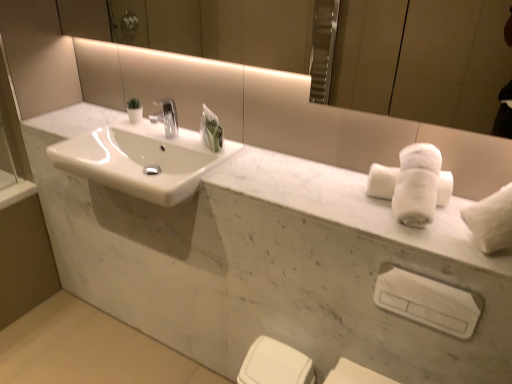
Image resolution: width=512 pixels, height=384 pixels. What do you see at coordinates (268, 263) in the screenshot?
I see `white marble sink at center, the 2th porcelain when ordered from bottom to top` at bounding box center [268, 263].

Measure the distance between white plastic towel bar at lower right and camera.

A distance of 3.40 feet exists between white plastic towel bar at lower right and camera.

At what (x,y) coordinates should I click in order to perform the action: click on white marble sink at center. Please return your answer as a coordinate pair (x, y). Looking at the image, I should click on (140, 160).

In order to face white fluffy bath towel at right, should I rotate leftwards or rightwards?

To face it directly, rotate right by 19.495 degrees.

The image size is (512, 384). Identify the location of white marble sink at center, the 2th porcelain when ordered from bottom to top. (268, 263).

Where is `concrete located on the left of white marble sink at center`? concrete located on the left of white marble sink at center is located at coordinates (88, 349).

Which is more to the left, white marble sink at center or smooth concrete floor at lower left?

From the viewer's perspective, smooth concrete floor at lower left appears more on the left side.

Considering the sizes of white marble sink at center and smooth concrete floor at lower left in the image, is white marble sink at center taller or shorter than smooth concrete floor at lower left?

In the image, white marble sink at center appears to be taller than smooth concrete floor at lower left.

Does point (190, 174) come in front of point (137, 360)?

That is True.

What's the angular difference between white glossy porcelain at lower center, marked as the second porcelain in a top-to-bottom arrangement, and white marble sink at center's facing directions?

The angular difference between white glossy porcelain at lower center, marked as the second porcelain in a top-to-bottom arrangement, and white marble sink at center is 0.182 degrees.

Can you confirm if white glossy porcelain at lower center, marked as the second porcelain in a top-to-bottom arrangement, is thinner than white marble sink at center?

Correct, the width of white glossy porcelain at lower center, marked as the second porcelain in a top-to-bottom arrangement, is less than that of white marble sink at center.

Is white glossy porcelain at lower center, which is counted as the first porcelain, starting from the bottom, positioned far away from white marble sink at center?

They are positioned close to each other.

I want to click on sink above the white glossy porcelain at lower center, marked as the second porcelain in a top-to-bottom arrangement (from the image's perspective), so click(x=140, y=160).

Who is smaller, white marble sink at center or white fluffy bath towel at right?

Smaller between the two is white fluffy bath towel at right.

Is white marble sink at center in contact with white fluffy bath towel at right?

No, white marble sink at center is not making contact with white fluffy bath towel at right.

How distant is white marble sink at center from white fluffy bath towel at right?

A: 72.59 centimeters.

From a real-world perspective, is white marble sink at center located higher than white fluffy bath towel at right?

→ Incorrect, from a real-world perspective, white marble sink at center is lower than white fluffy bath towel at right.

Looking at their sizes, would you say white plastic towel bar at lower right is wider or thinner than white marble sink at center, the 1th porcelain positioned from the top?

In the image, white plastic towel bar at lower right appears to be more narrow than white marble sink at center, the 1th porcelain positioned from the top.

In the image, is white plastic towel bar at lower right on the left side or the right side of white marble sink at center, the 1th porcelain positioned from the top?

white plastic towel bar at lower right is positioned on white marble sink at center, the 1th porcelain positioned from the top,'s right side.

This screenshot has height=384, width=512. I want to click on towel bar that is on the right side of white marble sink at center, the 1th porcelain positioned from the top, so click(x=428, y=302).

From a real-world perspective, is white plastic towel bar at lower right positioned above or below white marble sink at center, the 2th porcelain when ordered from bottom to top?

white plastic towel bar at lower right is below white marble sink at center, the 2th porcelain when ordered from bottom to top.

Where is `porcelain that is the 1st one below the white fluffy bath towel at right (from a real-world perspective)`? The image size is (512, 384). porcelain that is the 1st one below the white fluffy bath towel at right (from a real-world perspective) is located at coordinates (268, 263).

Which of these two, white marble sink at center, the 2th porcelain when ordered from bottom to top, or white fluffy bath towel at right, is smaller?

white fluffy bath towel at right is smaller.

Consider the image. Does white marble sink at center, the 2th porcelain when ordered from bottom to top, lie in front of white fluffy bath towel at right?

That is True.

Which point is more distant from viewer, (284, 243) or (392, 178)?

The point (284, 243) is more distant.

From the image's perspective, is white fluffy bath towel at right positioned above or below smooth concrete floor at lower left?

white fluffy bath towel at right is above smooth concrete floor at lower left.

Considering the relative sizes of white fluffy bath towel at right and smooth concrete floor at lower left in the image provided, is white fluffy bath towel at right wider than smooth concrete floor at lower left?

In fact, white fluffy bath towel at right might be narrower than smooth concrete floor at lower left.

Is white fluffy bath towel at right in front of smooth concrete floor at lower left?

That is True.

Based on the photo, which is farther, (412, 177) or (159, 382)?

Positioned behind is point (159, 382).

Are white fluffy bath towel at right and white marble sink at center located far from each other?

They are positioned close to each other.

Is white fluffy bath towel at right to the left of white marble sink at center from the viewer's perspective?

No.

Considering the sizes of white fluffy bath towel at right and white marble sink at center in the image, is white fluffy bath towel at right taller or shorter than white marble sink at center?

Clearly, white fluffy bath towel at right is taller compared to white marble sink at center.

Is point (436, 151) less distant than point (170, 141)?

Yes.

The width and height of the screenshot is (512, 384). What are the coordinates of `sink in front of the smooth concrete floor at lower left` in the screenshot? It's located at (140, 160).

Find the location of a particular element. sink that is above the white glossy porcelain at lower center, which is counted as the first porcelain, starting from the bottom (from a real-world perspective) is located at coordinates (140, 160).

Considering their positions, is white marble sink at center, the 1th porcelain positioned from the top, positioned further to white marble sink at center than white glossy porcelain at lower center, marked as the second porcelain in a top-to-bottom arrangement?

white glossy porcelain at lower center, marked as the second porcelain in a top-to-bottom arrangement, is positioned further to the anchor white marble sink at center.

In the scene shown: Estimate the real-world distances between objects in this image. Which object is closer to white plastic towel bar at lower right, white marble sink at center, the 2th porcelain when ordered from bottom to top, or white marble sink at center?

white marble sink at center, the 2th porcelain when ordered from bottom to top, is closer to white plastic towel bar at lower right.

From the image, which object appears to be farther from white fluffy bath towel at right, white glossy porcelain at lower center, marked as the second porcelain in a top-to-bottom arrangement, or white plastic towel bar at lower right?

The object further to white fluffy bath towel at right is white glossy porcelain at lower center, marked as the second porcelain in a top-to-bottom arrangement.

Which object lies further to the anchor point smooth concrete floor at lower left, white marble sink at center or white glossy porcelain at lower center, marked as the second porcelain in a top-to-bottom arrangement?

Based on the image, white marble sink at center appears to be further to smooth concrete floor at lower left.

Based on their spatial positions, is white glossy porcelain at lower center, which is counted as the first porcelain, starting from the bottom, or white marble sink at center, the 2th porcelain when ordered from bottom to top, closer to white plastic towel bar at lower right?

The object closer to white plastic towel bar at lower right is white glossy porcelain at lower center, which is counted as the first porcelain, starting from the bottom.

From the image, which object appears to be nearer to white marble sink at center, white plastic towel bar at lower right or white marble sink at center, the 1th porcelain positioned from the top?

white marble sink at center, the 1th porcelain positioned from the top, is closer to white marble sink at center.

Consider the image. Estimate the real-world distances between objects in this image. Which object is further from white marble sink at center, white fluffy bath towel at right or white plastic towel bar at lower right?

The object further to white marble sink at center is white plastic towel bar at lower right.

Estimate the real-world distances between objects in this image. Which object is closer to white glossy porcelain at lower center, which is counted as the first porcelain, starting from the bottom, white plastic towel bar at lower right or white marble sink at center, the 1th porcelain positioned from the top?

white marble sink at center, the 1th porcelain positioned from the top, is closer to white glossy porcelain at lower center, which is counted as the first porcelain, starting from the bottom.

Where is `towel bar between white fluffy bath towel at right and white glossy porcelain at lower center, marked as the second porcelain in a top-to-bottom arrangement, in the vertical direction`? towel bar between white fluffy bath towel at right and white glossy porcelain at lower center, marked as the second porcelain in a top-to-bottom arrangement, in the vertical direction is located at coordinates (428, 302).

Where is `bath towel located between white marble sink at center, the 2th porcelain when ordered from bottom to top, and white plastic towel bar at lower right in the left-right direction`? The image size is (512, 384). bath towel located between white marble sink at center, the 2th porcelain when ordered from bottom to top, and white plastic towel bar at lower right in the left-right direction is located at coordinates (413, 184).

This screenshot has width=512, height=384. In order to click on towel bar between white marble sink at center, the 2th porcelain when ordered from bottom to top, and white glossy porcelain at lower center, marked as the second porcelain in a top-to-bottom arrangement, in the up-down direction in this screenshot , I will do `click(428, 302)`.

The height and width of the screenshot is (384, 512). Find the location of `bath towel between white marble sink at center and white plastic towel bar at lower right`. bath towel between white marble sink at center and white plastic towel bar at lower right is located at coordinates (413, 184).